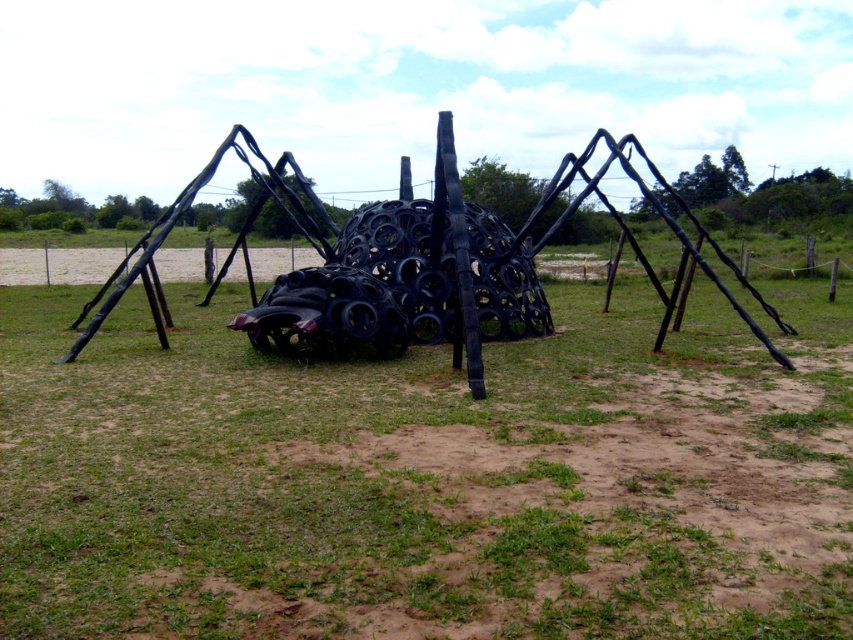
You are standing at the point marked as point (428,477) in the image. What type of ground material are you currently standing on?

You are standing on brown soil at center.